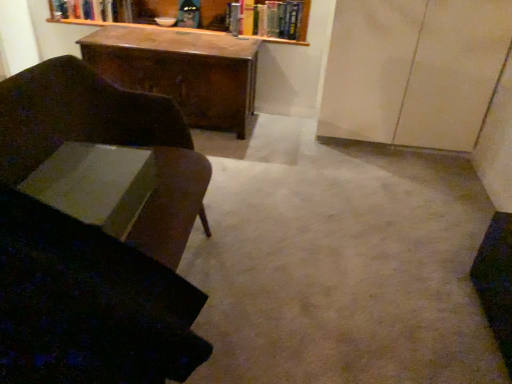
Question: From a real-world perspective, is white paper at lower left, positioned as the 3th book in back-to-front order, above or below wooden desk at center?

Choices:
 (A) below
 (B) above

Answer: (B)

Question: Do you think white paper at lower left, which is counted as the second book, starting from the left, is within wooden desk at center, or outside of it?

Choices:
 (A) inside
 (B) outside

Answer: (B)

Question: Estimate the real-world distances between objects in this image. Which object is closer to the velvet dark brown swivel chair at left?

Choices:
 (A) hardcover books at upper center, which is counted as the second book, starting from the top
 (B) wooden desk at center
 (C) velvet dark brown chair at left
 (D) white paper at lower left, the 2th book when ordered from right to left
 (E) matte beige cabinet at right

Answer: (D)

Question: Which object is positioned closest to the white paper at lower left, which is counted as the second book, starting from the left?

Choices:
 (A) matte beige cabinet at right
 (B) hardcover books at upper center, which is counted as the second book, starting from the top
 (C) wooden desk at center
 (D) hardcover book at upper center, marked as the 1th book in a top-to-bottom arrangement
 (E) velvet dark brown chair at left

Answer: (E)